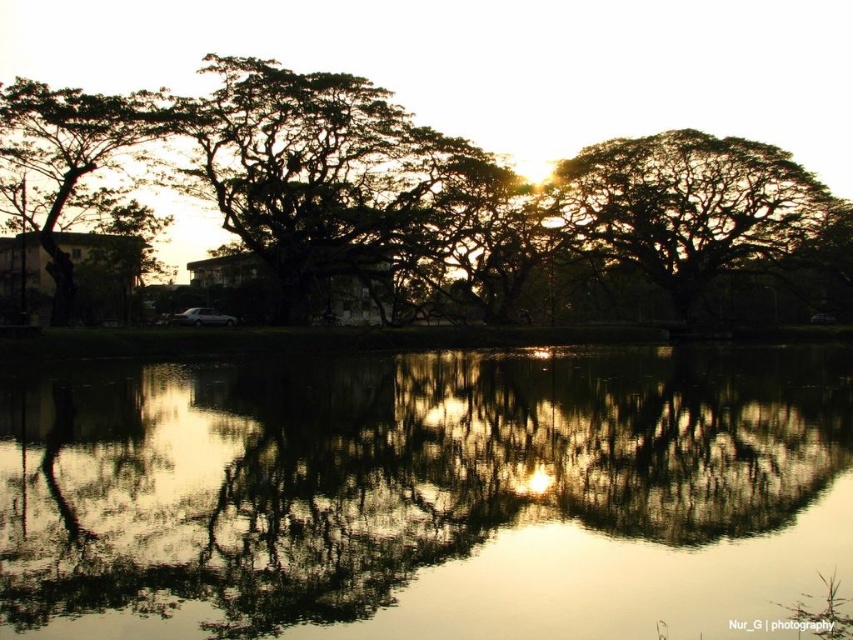
Question: Is silhouette leafy tree at center thinner than dark green leafy tree at left?

Choices:
 (A) no
 (B) yes

Answer: (A)

Question: Which object is positioned closest to the silhouette leafy tree at center?

Choices:
 (A) dark green leafy tree at left
 (B) dark green leafy tree at upper right
 (C) dark green leafy tree at center

Answer: (C)

Question: Among these points, which one is nearest to the camera?

Choices:
 (A) (676, 467)
 (B) (440, 182)
 (C) (15, 125)
 (D) (795, 170)

Answer: (A)

Question: Which object is positioned farthest from the smooth reflective water at center?

Choices:
 (A) dark green leafy tree at upper right
 (B) dark green leafy tree at center
 (C) silhouette leafy tree at center

Answer: (A)

Question: Does smooth reflective water at center have a greater width compared to dark green leafy tree at upper right?

Choices:
 (A) yes
 (B) no

Answer: (A)

Question: Is the position of silhouette leafy tree at center less distant than that of dark green leafy tree at upper right?

Choices:
 (A) yes
 (B) no

Answer: (A)